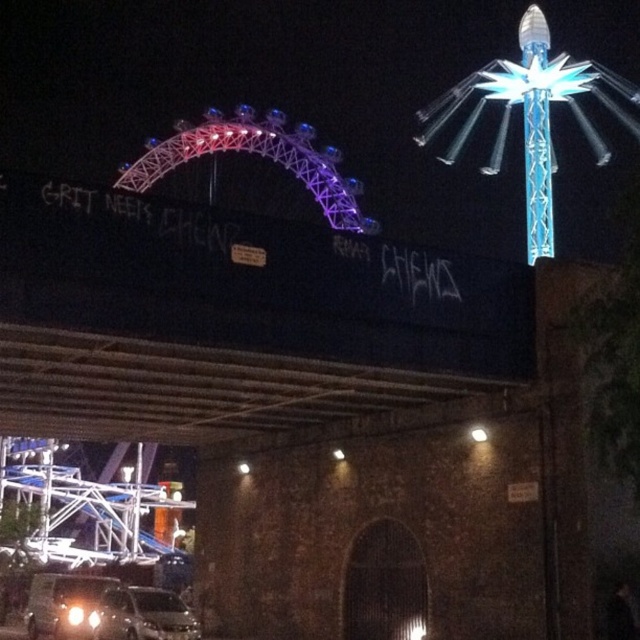
You are a photographer trying to capture both the metallic silver car at lower left and the shiny silver car at lower left in a single shot. Since they are both silver, how can you distinguish them in the photo?

The metallic silver car at lower left is located above the shiny silver car at lower left, so you can distinguish them by their vertical positions in the photo.

You are a pedestrian standing at the entrance of the fairground. You see a shiny silver car at lower left and a white glossy headlight at lower left. Which object is closer to you?

The shiny silver car at lower left is closer to you because it is in front of the white glossy headlight at lower left.

You are a photographer standing at the center of the scene wanting to capture both the shiny silver car at lower left and the white glossy headlight at lower left in a single frame. Since you can only focus on one object at a time, which object should you choose to ensure the other remains in the background without being too blurry?

You should focus on the shiny silver car at lower left because it is larger in size than the white glossy headlight at lower left, so keeping it in focus will ensure the smaller headlight stays sharp in the background.